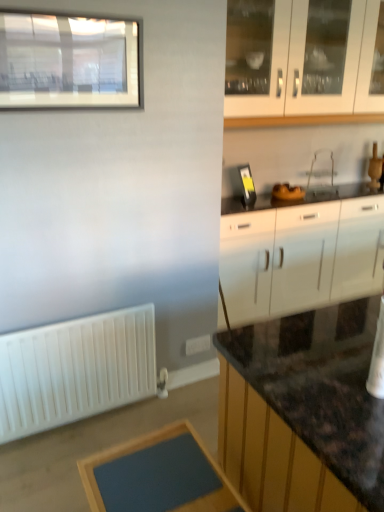
Locate an element on the screen. The image size is (384, 512). blank space situated above blue matte table at lower center (from a real-world perspective) is located at coordinates (163, 472).